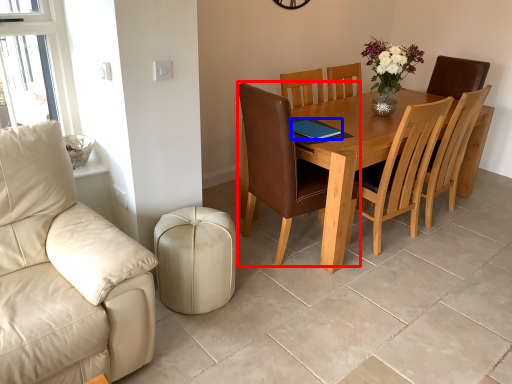
Question: Which of the following is the farthest to the observer, chair (highlighted by a red box) or pad (highlighted by a blue box)?

Choices:
 (A) chair
 (B) pad

Answer: (B)